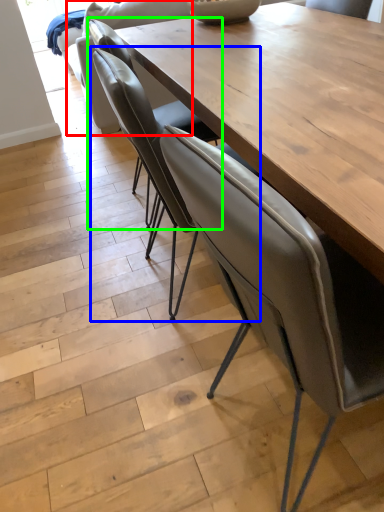
Question: Estimate the real-world distances between objects in this image. Which object is farther from armchair (highlighted by a red box), chair (highlighted by a blue box) or chair (highlighted by a green box)?

Choices:
 (A) chair
 (B) chair

Answer: (A)